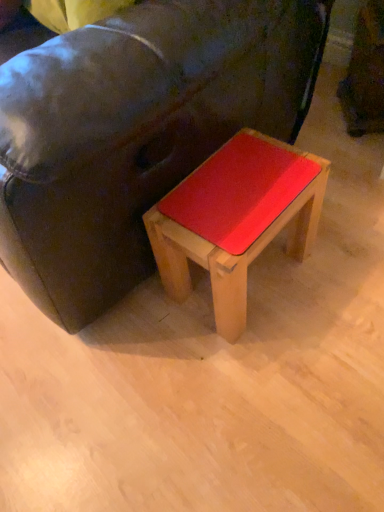
I want to click on free space above matte wood stool at center (from a real-world perspective), so click(x=231, y=189).